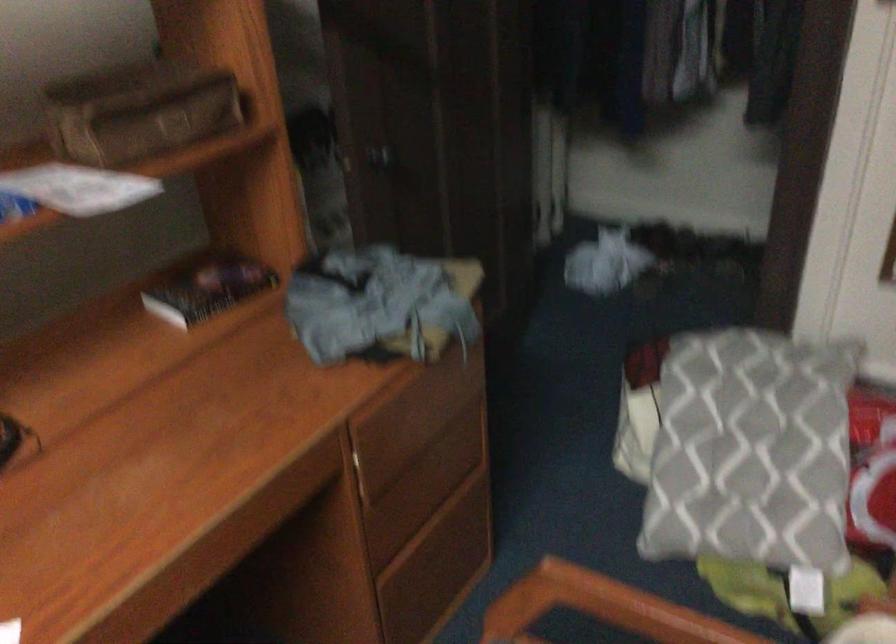
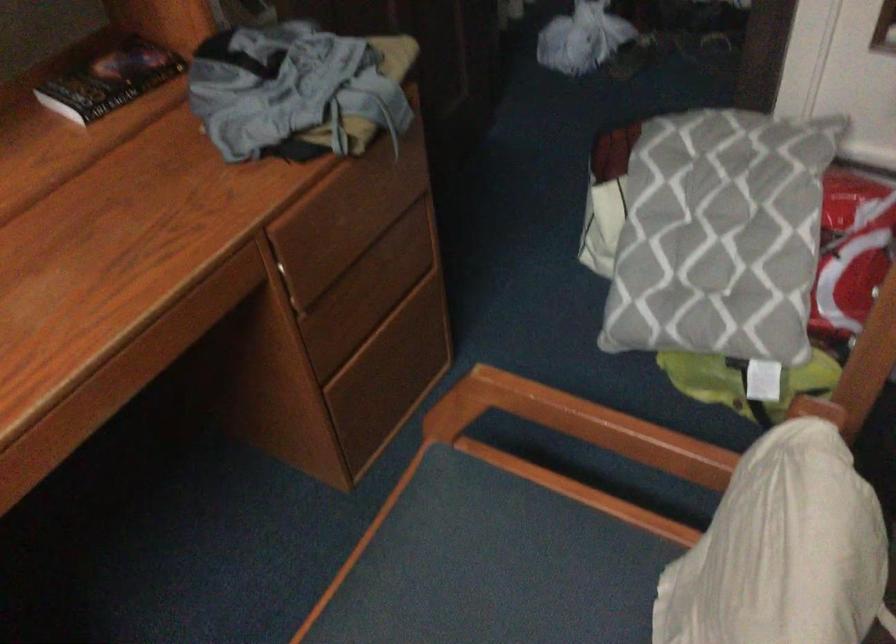
Question: How did the camera likely rotate?

Choices:
 (A) Left
 (B) Right
 (C) Up
 (D) Down

Answer: (D)